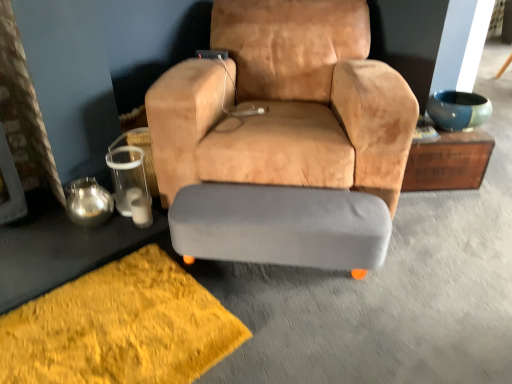
Image resolution: width=512 pixels, height=384 pixels. I want to click on free space in front of gray fabric ottoman at center, so click(x=305, y=327).